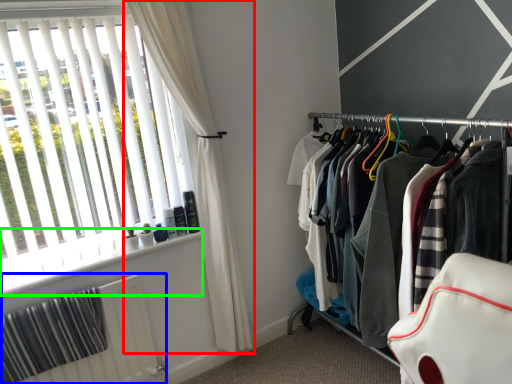
Question: Which is farther away from curtain (highlighted by a red box)? radiator (highlighted by a blue box) or window sill (highlighted by a green box)?

Choices:
 (A) radiator
 (B) window sill

Answer: (A)